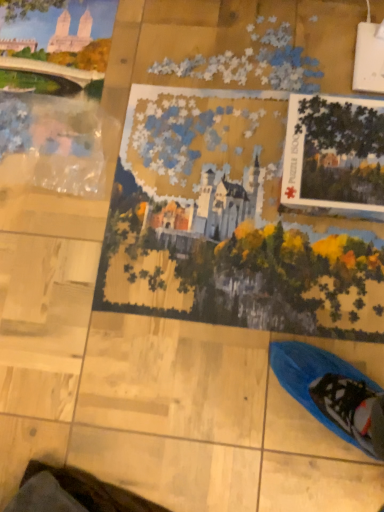
Find the location of `vacant region above matte cardboard puzzle box at upper right (from a real-world perspective)`. vacant region above matte cardboard puzzle box at upper right (from a real-world perspective) is located at coordinates (347, 145).